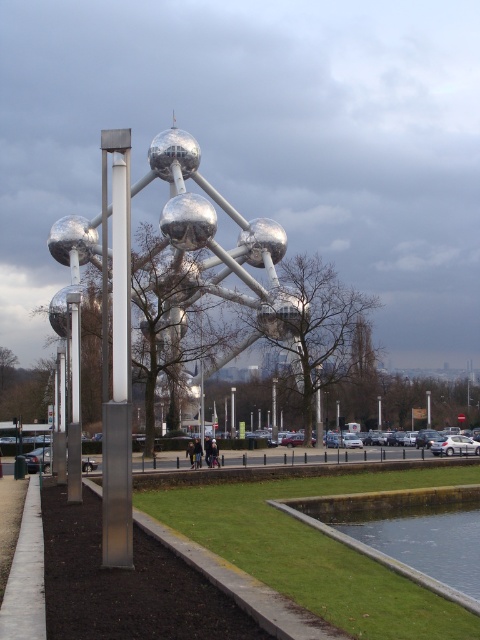
What do you see at coordinates (372, 547) in the screenshot? I see `clear water at lower center` at bounding box center [372, 547].

I want to click on clear water at lower center, so click(372, 547).

Based on the photo, measure the distance between point (391, 570) and camera.

A distance of 15.32 meters exists between point (391, 570) and camera.

Where is `clear water at lower center`? clear water at lower center is located at coordinates (372, 547).

Is silver polished pole at left below clear water at lower center?

Actually, silver polished pole at left is above clear water at lower center.

Does silver polished pole at left have a lesser width compared to clear water at lower center?

Indeed, silver polished pole at left has a lesser width compared to clear water at lower center.

What do you see at coordinates (118, 360) in the screenshot?
I see `silver polished pole at left` at bounding box center [118, 360].

This screenshot has width=480, height=640. In order to click on silver polished pole at left in this screenshot , I will do `click(118, 360)`.

Is point (120, 294) positioned before point (71, 449)?

Yes, point (120, 294) is in front of point (71, 449).

Which is above, silver polished pole at left or silver metallic pole at center?

silver metallic pole at center

I want to click on silver polished pole at left, so click(118, 360).